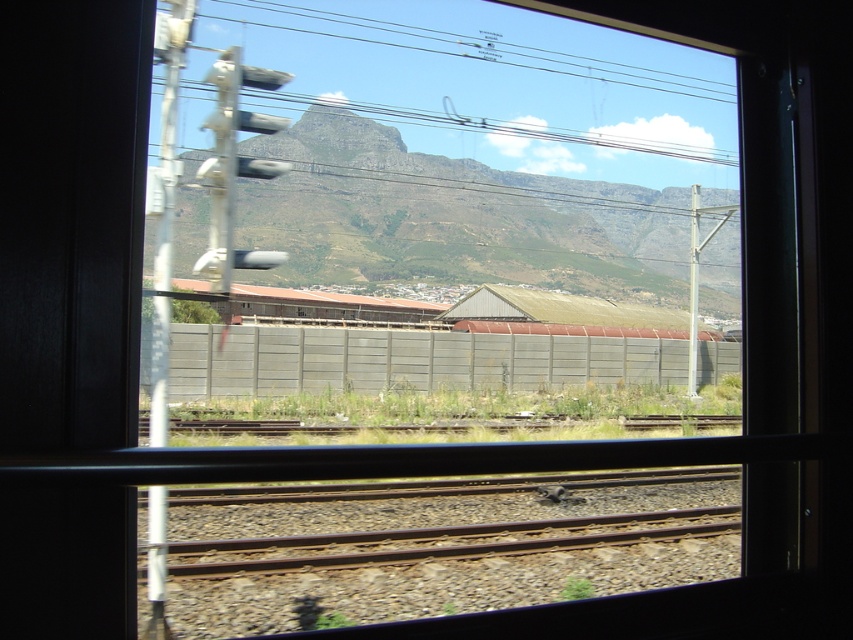
Question: Which point appears closest to the camera in this image?

Choices:
 (A) (422, 560)
 (B) (352, 177)

Answer: (A)

Question: Does green grassy mountain at center appear on the left side of rusty metal train track at bottom?

Choices:
 (A) yes
 (B) no

Answer: (A)

Question: Does green grassy mountain at center appear under rusty metal train track at bottom?

Choices:
 (A) no
 (B) yes

Answer: (A)

Question: Among these objects, which one is nearest to the camera?

Choices:
 (A) green grassy mountain at center
 (B) rusty metal train track at bottom

Answer: (A)

Question: Is green grassy mountain at center closer to camera compared to rusty metal train track at bottom?

Choices:
 (A) no
 (B) yes

Answer: (B)